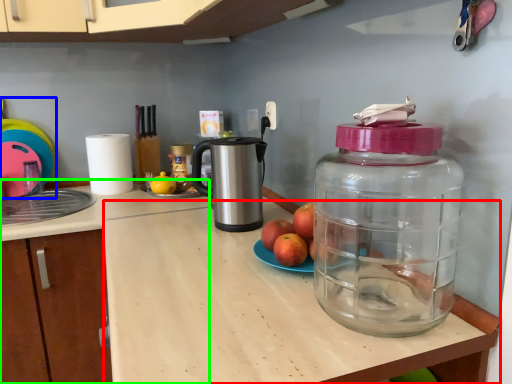
Question: Which object is the closest to the counter top (highlighted by a red box)? Choose among these: toy (highlighted by a blue box) or counter top (highlighted by a green box).

Choices:
 (A) toy
 (B) counter top

Answer: (B)